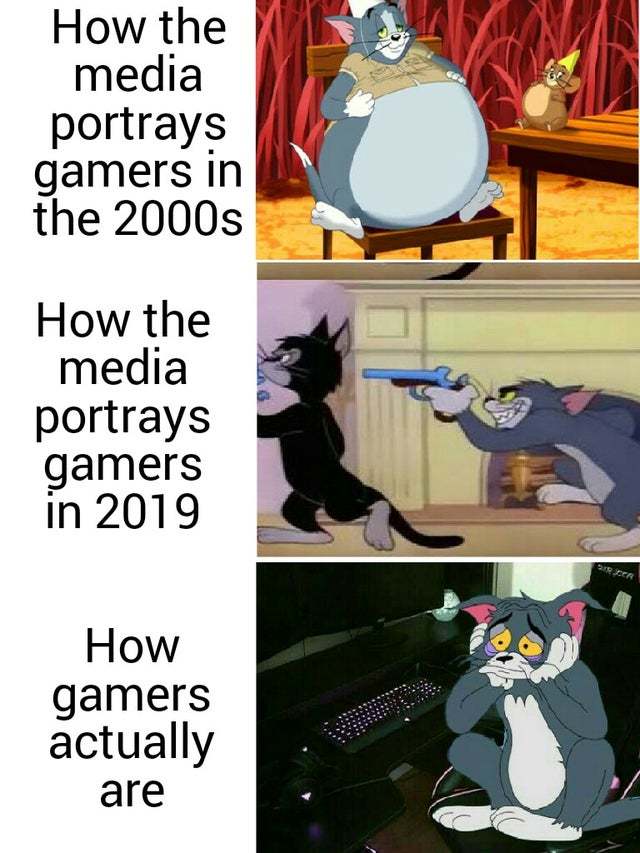
Find the location of a particular element. This screenshot has height=853, width=640. keyboard is located at coordinates (396, 705).